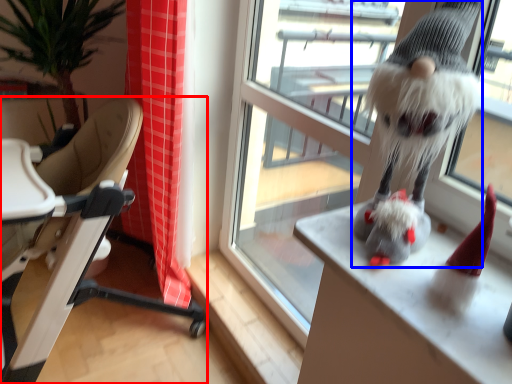
Question: Which object is further to the camera taking this photo, chair (highlighted by a red box) or animal (highlighted by a blue box)?

Choices:
 (A) chair
 (B) animal

Answer: (A)